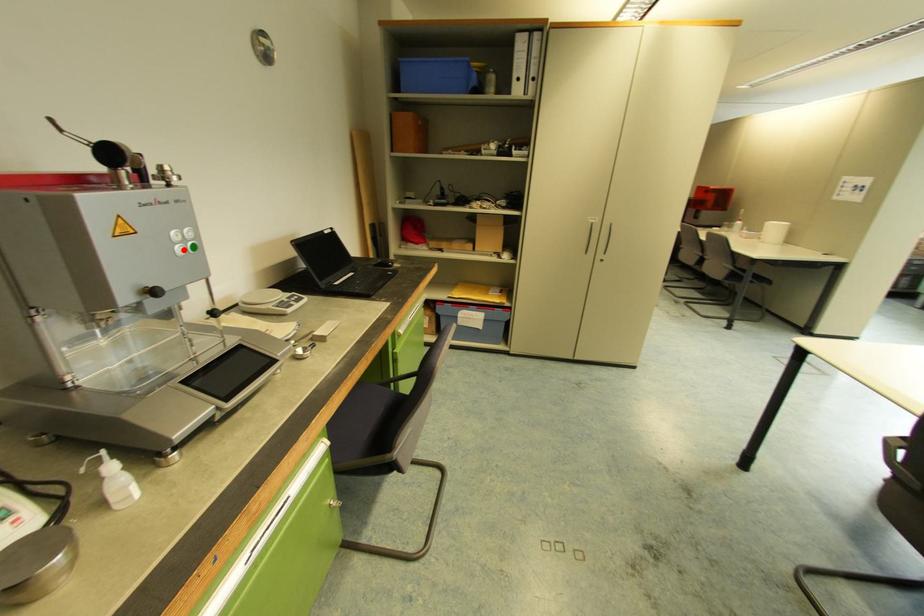
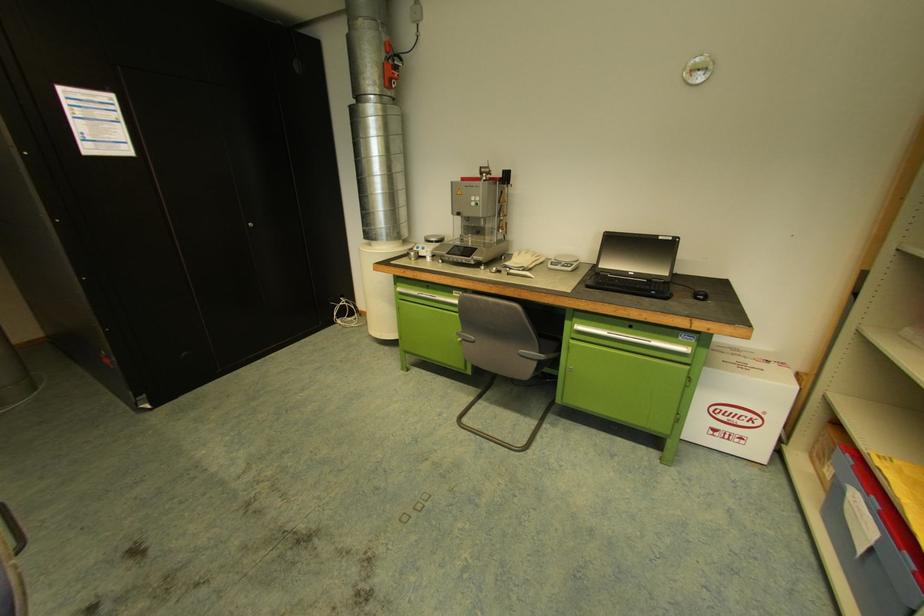
Question: I am providing you with two images of the same scene from different viewpoints. Given a red point in image1, look at the same physical point in image2. Is it:

Choices:
 (A) Closer to the viewpoint
 (B) Farther from the viewpoint

Answer: (A)